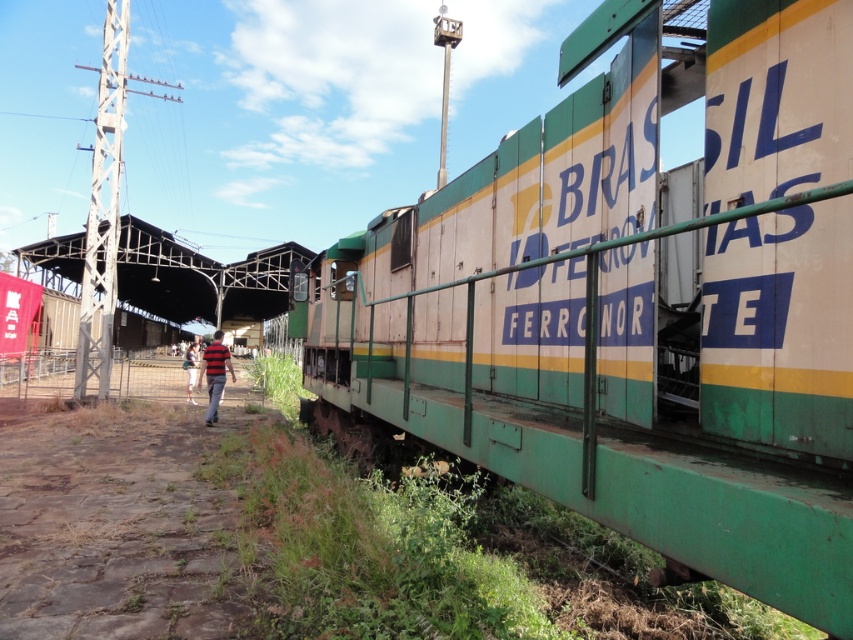
Who is shorter, brown stone dirt track at lower left or white cotton shirt at center?

brown stone dirt track at lower left

Between brown stone dirt track at lower left and white cotton shirt at center, which one is positioned lower?

brown stone dirt track at lower left is lower down.

Which is behind, point (50, 531) or point (190, 380)?

Point (190, 380)

The height and width of the screenshot is (640, 853). I want to click on brown stone dirt track at lower left, so click(x=115, y=524).

Which is more to the left, green painted metal train car at right or striped shirt at center?

From the viewer's perspective, striped shirt at center appears more on the left side.

Who is more distant from viewer, (824, 630) or (215, 420)?

The point (215, 420) is more distant.

The image size is (853, 640). Identify the location of green painted metal train car at right. (631, 305).

Is point (659, 532) behind point (51, 602)?

No, it is not.

Can you confirm if green painted metal train car at right is positioned to the left of brown stone dirt track at lower left?

No, green painted metal train car at right is not to the left of brown stone dirt track at lower left.

Find the location of a particular element. The height and width of the screenshot is (640, 853). green painted metal train car at right is located at coordinates (631, 305).